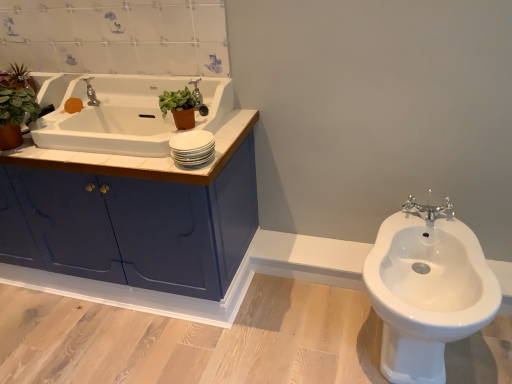
Question: Looking at the image, does chrome metallic tap at upper left, placed as the 1th tap when sorted from top to bottom, seem bigger or smaller compared to green matte plant at upper center, the second plant when ordered from back to front?

Choices:
 (A) big
 (B) small

Answer: (A)

Question: Looking at their shapes, would you say chrome metallic tap at upper left, which ranks as the 2th tap in bottom-to-top order, is wider or thinner than green matte plant at upper center, marked as the first plant in a front-to-back arrangement?

Choices:
 (A) wide
 (B) thin

Answer: (A)

Question: Which is nearer to the white glossy bidet at right?

Choices:
 (A) chrome metallic tap at right, positioned as the 2th tap in top-to-bottom order
 (B) green matte plant at upper center, the second plant when ordered from back to front
 (C) orange matte soap at upper left
 (D) blue glossy cabinet at left
 (E) chrome metallic tap at upper left, which is counted as the 1th tap, starting from the back

Answer: (A)

Question: Which of these objects is positioned farthest from the green matte plant at upper center, the second plant when ordered from back to front?

Choices:
 (A) chrome metallic tap at upper left, the second tap viewed from the right
 (B) white wood counter top at upper left
 (C) blue glossy cabinet at left
 (D) green matte plant at upper left, which appears as the first plant when viewed from the back
 (E) white glossy bidet at right

Answer: (E)